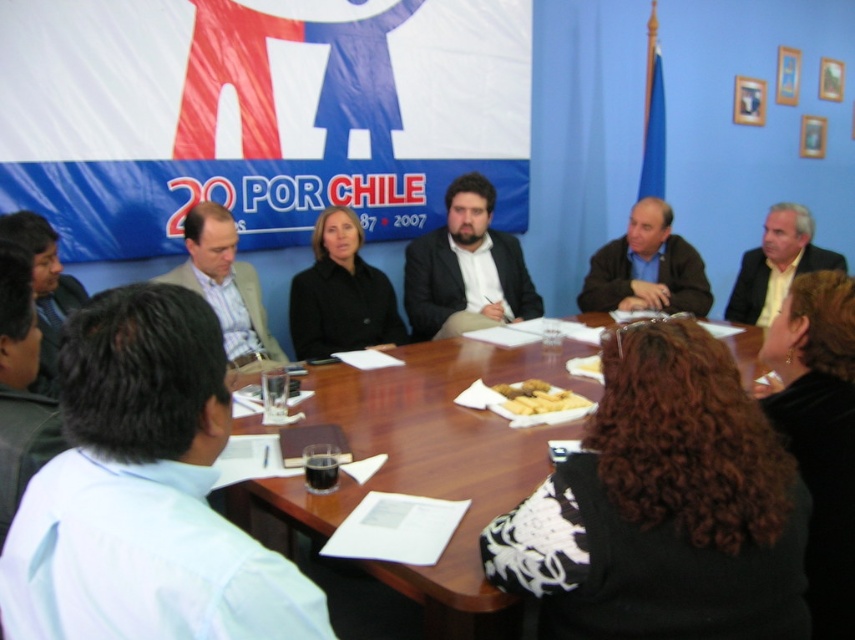
Question: Does light brown suit at center appear on the right side of white crumbly bread at center?

Choices:
 (A) no
 (B) yes

Answer: (A)

Question: Based on their relative distances, which object is farther from the dark brown leather jacket at right?

Choices:
 (A) matte black suit at center
 (B) wooden table at center
 (C) light brown suit at upper right
 (D) white shirt at lower left

Answer: (D)

Question: Which object appears farthest from the camera in this image?

Choices:
 (A) white crumbly bread at center
 (B) light brown suit at center

Answer: (B)

Question: Is matte black suit at center positioned at the back of light brown suit at upper right?

Choices:
 (A) yes
 (B) no

Answer: (B)

Question: Among these objects, which one is farthest from the camera?

Choices:
 (A) white crumbly bread at center
 (B) white shirt at lower left
 (C) light brown suit at center

Answer: (C)

Question: From the image, what is the correct spatial relationship of matte black suit at center in relation to light brown suit at upper right?

Choices:
 (A) right
 (B) left

Answer: (B)